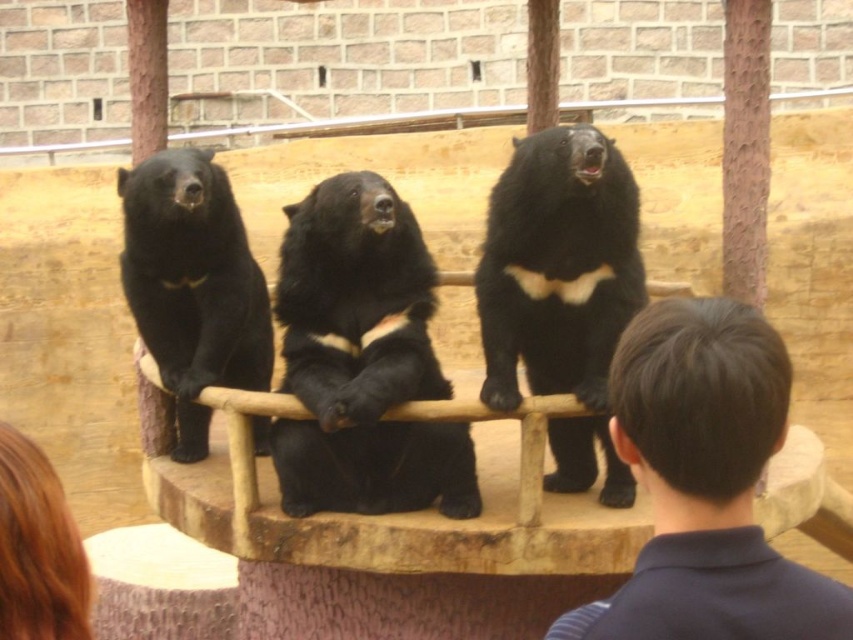
You are standing at the point marked by the coordinates point (561, 291) in the image. Looking around, you see three black bears on a wooden platform. Which direction should you move to reach the black furry bear at center?

The point (561, 291) corresponds to the black furry bear at center, so you are already at that location.

You are a zookeeper who needs to place a feeding tray between the black fur bear at center and the black fur bear at left. Which bear requires a wider feeding tray based on their size?

The black fur bear at center requires a wider feeding tray because its width is larger than the black fur bear at left.